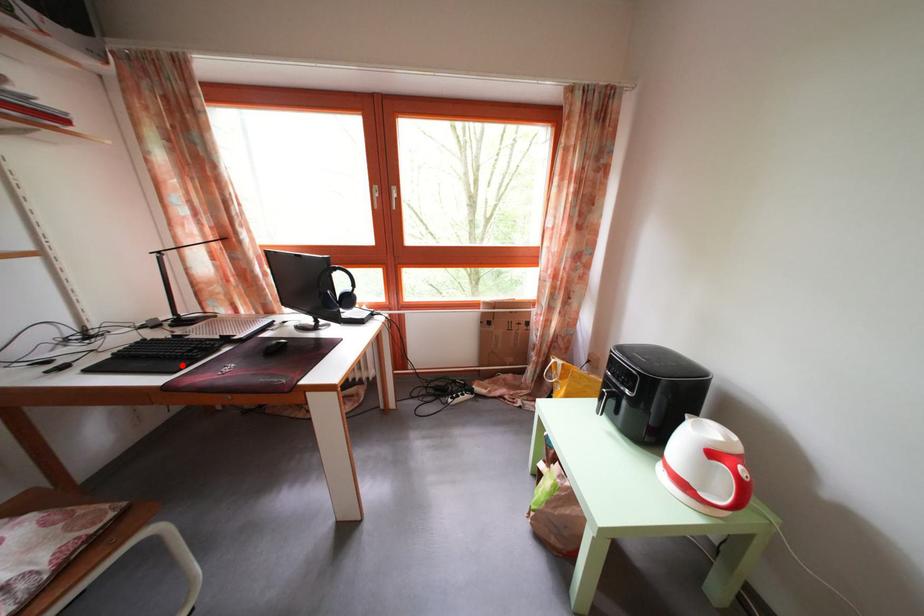
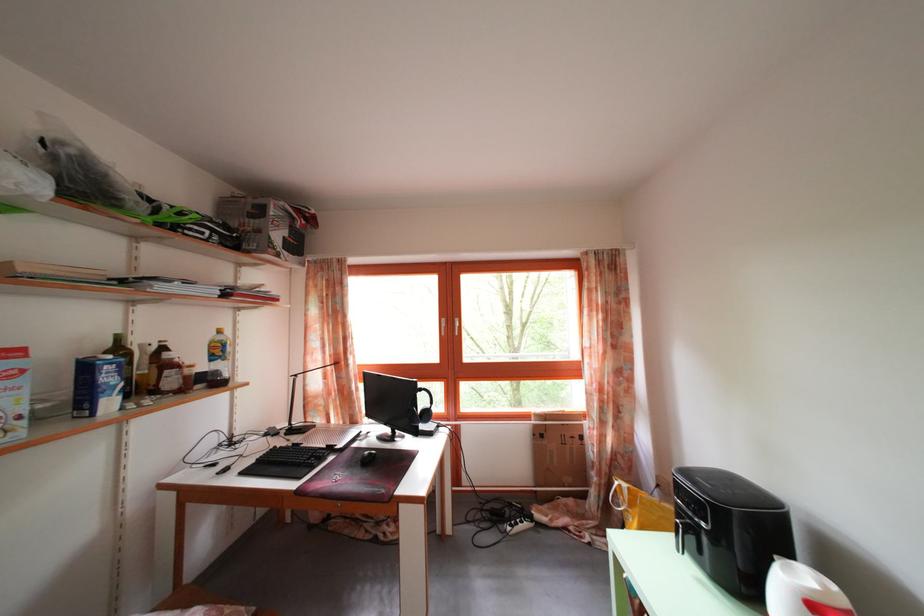
The point at the highlighted location is marked in the first image. Where is the corresponding point in the second image?

(307, 472)